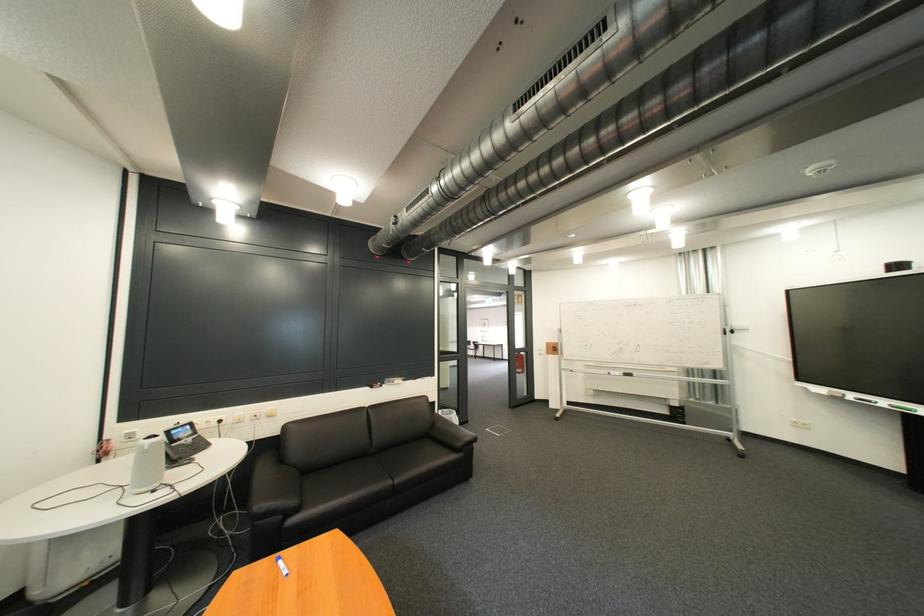
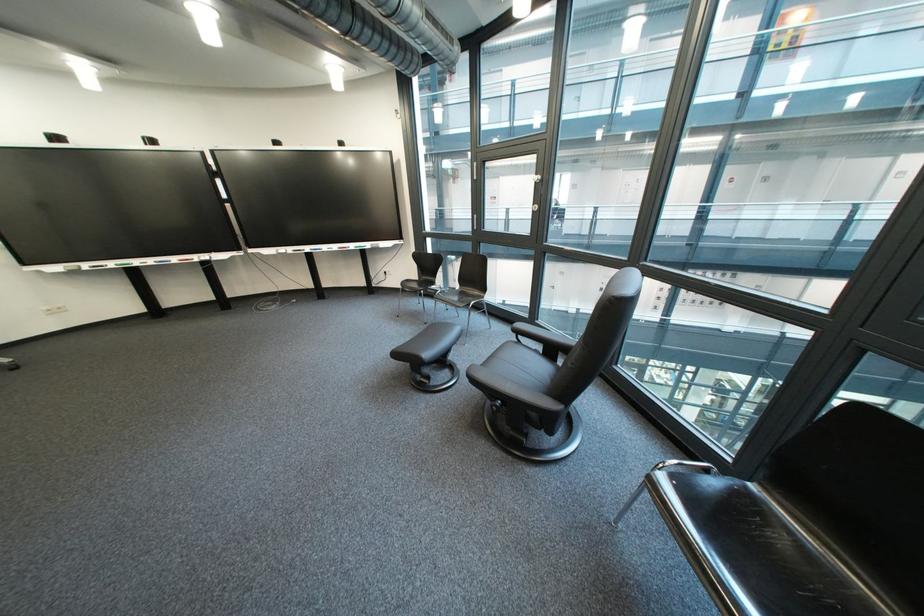
In the second image, find the point that corresponds to (x=866, y=398) in the first image.

(100, 267)